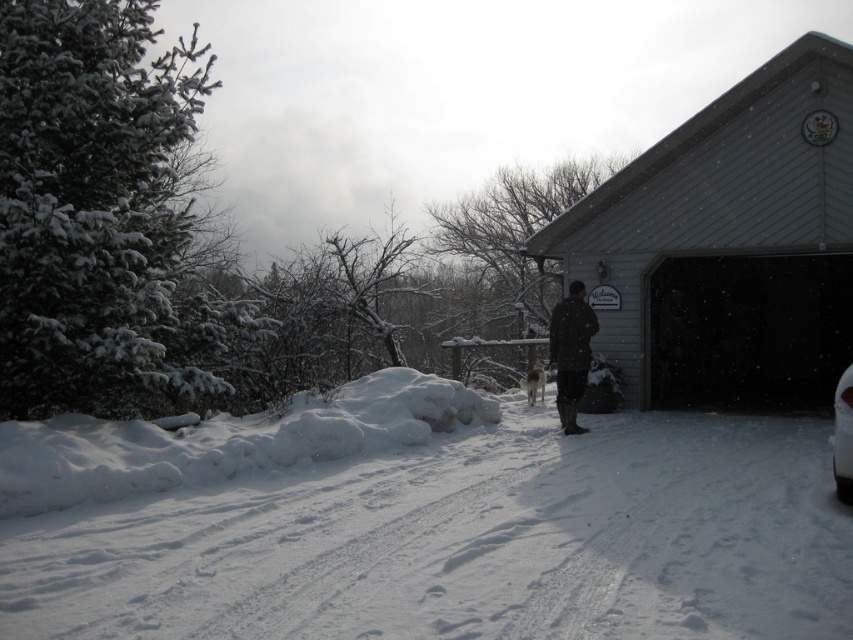
Question: Does gray siding garage at upper right have a larger size compared to white glossy car at lower right?

Choices:
 (A) yes
 (B) no

Answer: (A)

Question: Which point appears closest to the camera in this image?

Choices:
 (A) (560, 360)
 (B) (451, 598)
 (C) (741, 204)

Answer: (B)

Question: Is white fluffy snow at center below black wool coat at center?

Choices:
 (A) yes
 (B) no

Answer: (A)

Question: Can you confirm if black wool coat at center is smaller than white glossy car at lower right?

Choices:
 (A) yes
 (B) no

Answer: (A)

Question: Which object appears farthest from the camera in this image?

Choices:
 (A) black wool coat at center
 (B) white glossy car at lower right
 (C) gray siding garage at upper right
 (D) white fluffy snow at center

Answer: (C)

Question: Which object is the closest to the black wool coat at center?

Choices:
 (A) gray siding garage at upper right
 (B) white fluffy snow at center

Answer: (B)